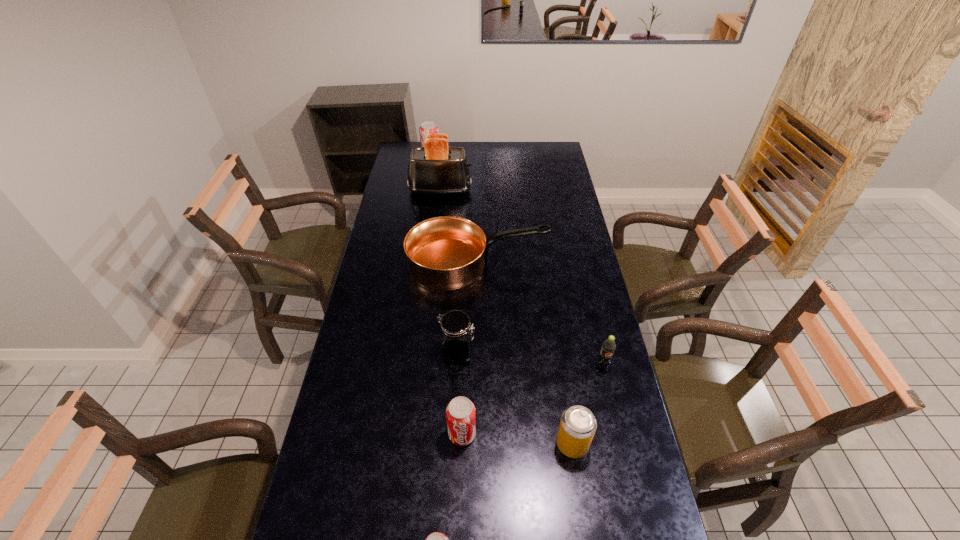
I want to click on vacant space located on the side of the gray toaster with the control lever, so point(527,191).

Image resolution: width=960 pixels, height=540 pixels. I want to click on vacant region located on the logo side of the tallest soda can, so click(511, 159).

At what (x,y) coordinates should I click in order to perform the action: click on vacant region located 0.160m on the handle side of the frying pan. Please return your answer as a coordinate pair (x, y). The image size is (960, 540). Looking at the image, I should click on (585, 264).

The image size is (960, 540). I want to click on blank space located 0.110m on the lid of the jar, so click(x=508, y=353).

Locate an element on the screen. The height and width of the screenshot is (540, 960). vacant region located on the front label of the fourth nearest soda can is located at coordinates (618, 433).

Identify the location of free space located 0.160m on the logo side of the second nearest red soda can. This screenshot has width=960, height=540. (460, 507).

You are a GUI agent. You are given a task and a screenshot of the screen. Output one action in this format:
    pyautogui.click(x=<x>, y=<y>)
    Task: Click on the blank space located on the back of the fourth soda can from left to right
    
    Given the screenshot: What is the action you would take?
    pyautogui.click(x=558, y=348)

You are a GUI agent. You are given a task and a screenshot of the screen. Output one action in this format:
    pyautogui.click(x=<x>, y=<y>)
    Task: Click on the object at the far edge
    The height and width of the screenshot is (540, 960).
    Given the screenshot: What is the action you would take?
    pyautogui.click(x=426, y=127)

I want to click on toaster at the left edge, so click(x=435, y=169).

Locate an element on the screen. soda can situated at the left edge is located at coordinates (426, 127).